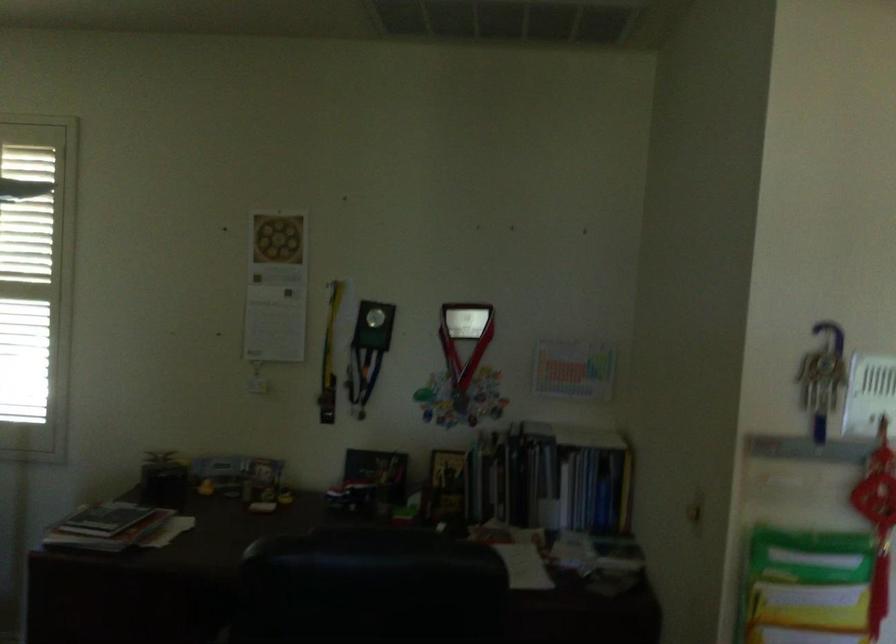
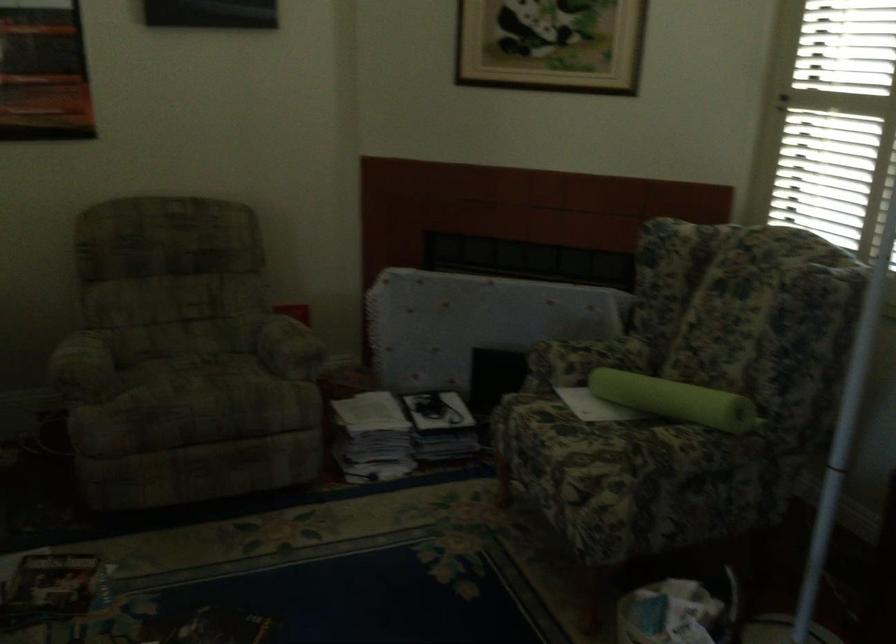
Question: How did the camera likely rotate?

Choices:
 (A) Left
 (B) Right
 (C) Up
 (D) Down

Answer: (A)